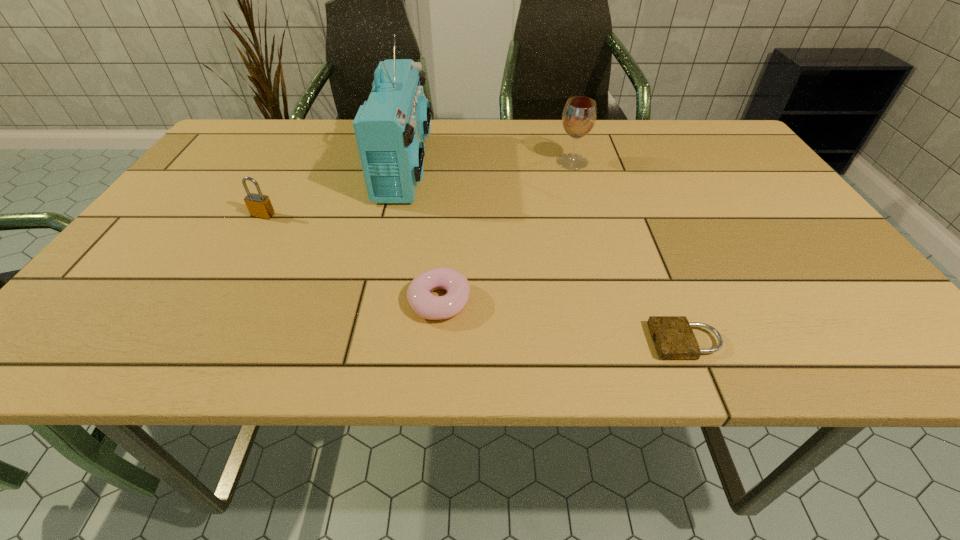
I want to click on empty location between the doughnut and the shortest object, so click(563, 321).

Locate an element on the screen. free area in between the fourth object from left to right and the taller padlock is located at coordinates (418, 188).

This screenshot has width=960, height=540. I want to click on vacant space that's between the shortest object and the fourth shortest object, so click(x=629, y=252).

You are a GUI agent. You are given a task and a screenshot of the screen. Output one action in this format:
    pyautogui.click(x=<x>, y=<y>)
    Task: Click on the empty location between the third farthest object and the tallest object
    The image size is (960, 540).
    Given the screenshot: What is the action you would take?
    pyautogui.click(x=334, y=191)

Find the location of `free point between the doughnut and the third nearest object`. free point between the doughnut and the third nearest object is located at coordinates (351, 258).

The image size is (960, 540). I want to click on empty location between the doughnut and the radio receiver, so click(422, 234).

Identify the location of vacant area between the radio receiver and the second tallest object. This screenshot has height=540, width=960. (489, 164).

Locate an element on the screen. The height and width of the screenshot is (540, 960). object that ranks as the second closest to the leftmost object is located at coordinates (424, 304).

Where is `object that can be found as the second closest to the taller padlock`? The width and height of the screenshot is (960, 540). object that can be found as the second closest to the taller padlock is located at coordinates (424, 304).

Identify the location of vacant region that satisfies the following two spatial constraints: 1. on the front-facing side of the radio receiver; 2. on the right side of the doughnut. The width and height of the screenshot is (960, 540). (374, 301).